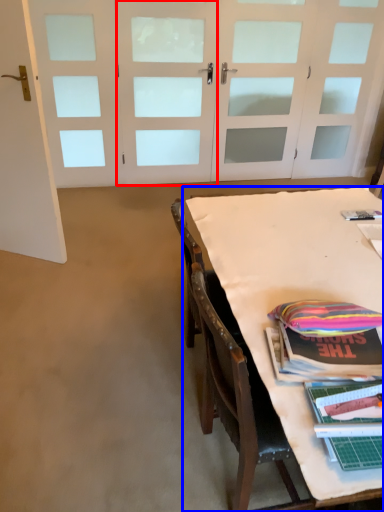
Question: Which object is further to the camera taking this photo, door (highlighted by a red box) or table (highlighted by a blue box)?

Choices:
 (A) door
 (B) table

Answer: (A)